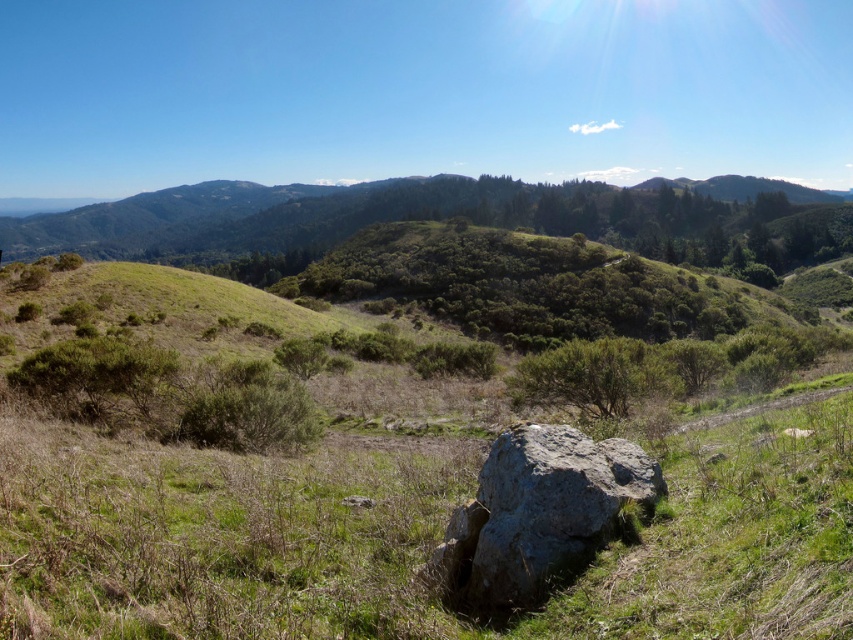
You are standing on the grassy hillside in the foreground of this natural landscape. You see two points marked on the image, point 1 at coordinates point (508, 212) and point 2 at coordinates point (581, 547). Which point is closer to you?

Point (508, 212) is closer to you because it is further to the viewer than point (581, 547).

You are standing at the point marked by the coordinates point (225, 477) in the image. What do you see directly below you?

The green grassy area at center is located at point (225, 477), so you would see green grassy at center directly below you.